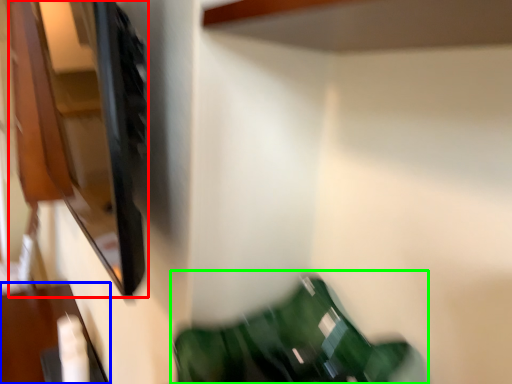
Question: Which object is the farthest from cabinet (highlighted by a red box)? Choose among these: furniture (highlighted by a blue box) or bean bag chair (highlighted by a green box).

Choices:
 (A) furniture
 (B) bean bag chair

Answer: (B)